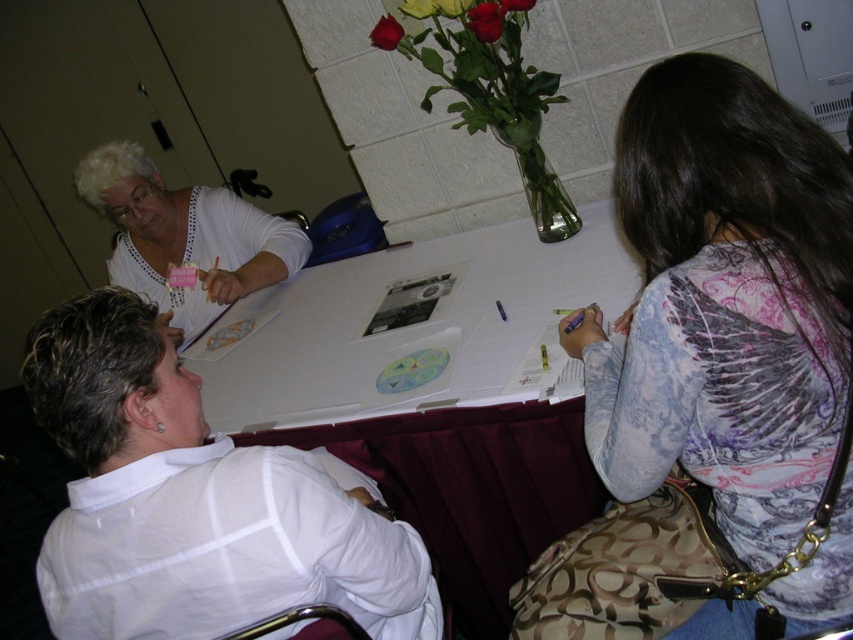
You are standing at the center of the room and see two points marked on the floor. The first point is at position point (172,480) and the second point is at position point (264,257). Which point is closer to you?

Point (172,480) is in front of point (264,257), so it is closer to you.

You are organizing a clothing donation drive and need to determine which item takes up more space horizontally. Based on the scene, which clothing item has a greater width between the printed fabric shirt at right and the white dotted blouse at upper left?

The white dotted blouse at upper left has a greater width than the printed fabric shirt at right.